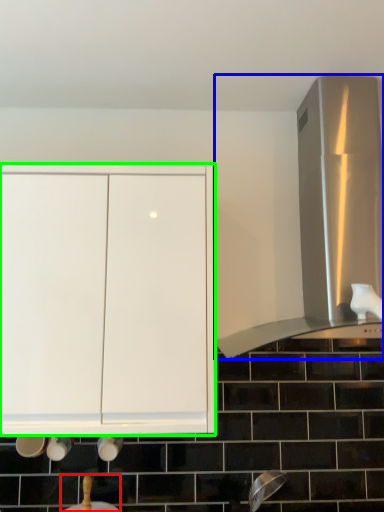
Question: Considering the real-world distances, which object is farthest from sink (highlighted by a red box)? vent (highlighted by a blue box) or cabinetry (highlighted by a green box)?

Choices:
 (A) vent
 (B) cabinetry

Answer: (A)